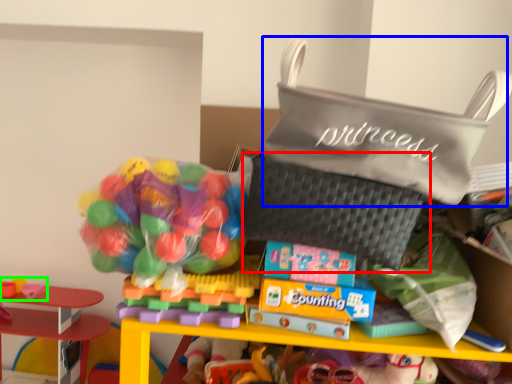
Question: Based on their relative distances, which object is farther from pouch (highlighted by a red box)? Choose from pouch (highlighted by a blue box) and toy (highlighted by a green box).

Choices:
 (A) pouch
 (B) toy

Answer: (B)